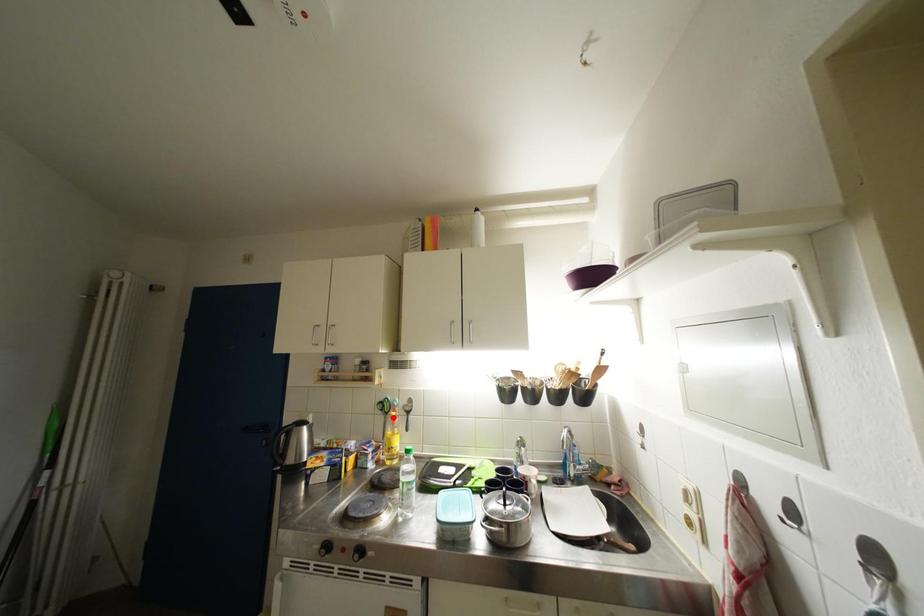
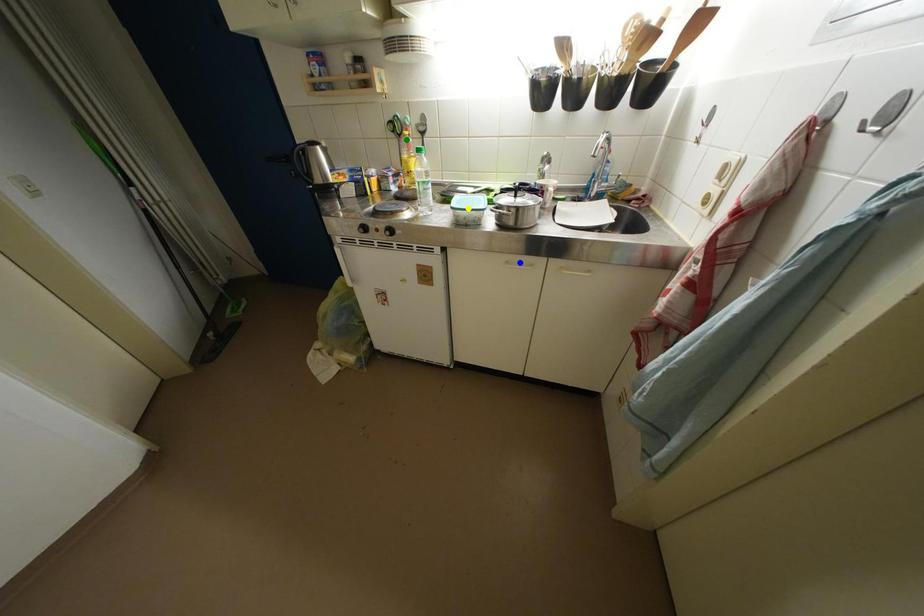
Question: I am providing you with two images of the same scene from different viewpoints. A red point is marked on the first image. You are given multiple points on the second image. In image 2, which mark is for the same physical point as the one in image 1?

Choices:
 (A) green point
 (B) yellow point
 (C) blue point

Answer: (A)